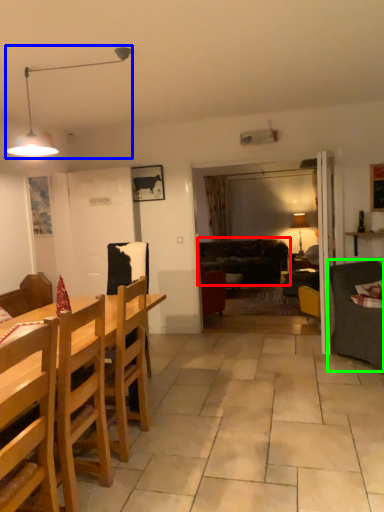
Question: Estimate the real-world distances between objects in this image. Which object is farther from studio couch (highlighted by a red box), lamp (highlighted by a blue box) or studio couch (highlighted by a green box)?

Choices:
 (A) lamp
 (B) studio couch

Answer: (A)